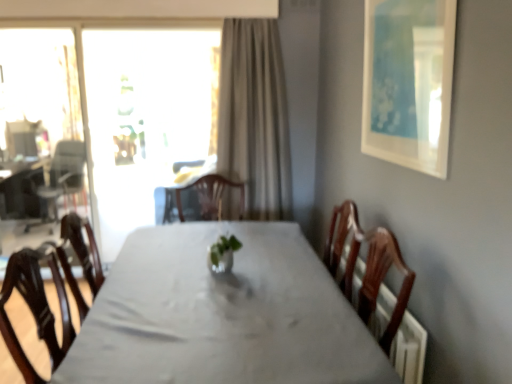
Question: Can you confirm if transparent glass screen door at left is positioned to the left of transparent glass window at upper left?

Choices:
 (A) yes
 (B) no

Answer: (A)

Question: Considering the relative positions of transparent glass screen door at left and transparent glass window at upper left in the image provided, is transparent glass screen door at left to the right of transparent glass window at upper left from the viewer's perspective?

Choices:
 (A) yes
 (B) no

Answer: (B)

Question: Are transparent glass screen door at left and transparent glass window at upper left located far from each other?

Choices:
 (A) yes
 (B) no

Answer: (B)

Question: Is transparent glass screen door at left taller than transparent glass window at upper left?

Choices:
 (A) no
 (B) yes

Answer: (A)

Question: Is transparent glass screen door at left smaller than transparent glass window at upper left?

Choices:
 (A) no
 (B) yes

Answer: (B)

Question: Visually, is beige fabric curtain at center positioned to the left or to the right of transparent glass window at upper left?

Choices:
 (A) right
 (B) left

Answer: (A)

Question: Looking at their shapes, would you say beige fabric curtain at center is wider or thinner than transparent glass window at upper left?

Choices:
 (A) wide
 (B) thin

Answer: (A)

Question: Considering the positions of beige fabric curtain at center and transparent glass window at upper left in the image, is beige fabric curtain at center bigger or smaller than transparent glass window at upper left?

Choices:
 (A) small
 (B) big

Answer: (A)

Question: Is point (224, 84) closer or farther from the camera than point (5, 41)?

Choices:
 (A) closer
 (B) farther

Answer: (A)

Question: Visually, is transparent glass window at upper left positioned to the left or to the right of white matte picture frame at upper right?

Choices:
 (A) left
 (B) right

Answer: (A)

Question: Looking at their shapes, would you say transparent glass window at upper left is wider or thinner than white matte picture frame at upper right?

Choices:
 (A) thin
 (B) wide

Answer: (B)

Question: From the image's perspective, relative to white matte picture frame at upper right, is transparent glass window at upper left above or below?

Choices:
 (A) above
 (B) below

Answer: (B)

Question: From a real-world perspective, is transparent glass window at upper left positioned above or below white matte picture frame at upper right?

Choices:
 (A) above
 (B) below

Answer: (B)

Question: From the image's perspective, is white matte picture frame at upper right positioned above or below matte black armchair at left?

Choices:
 (A) above
 (B) below

Answer: (A)

Question: Relative to matte black armchair at left, is white matte picture frame at upper right in front or behind?

Choices:
 (A) behind
 (B) front

Answer: (B)